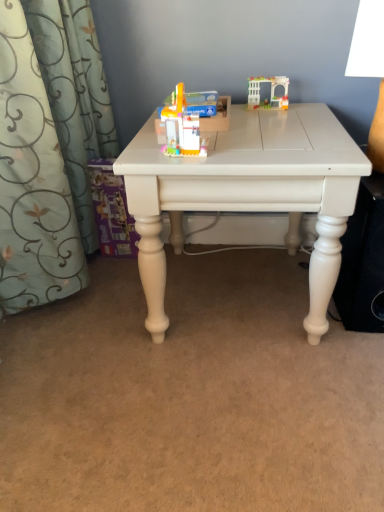
Question: From their relative heights in the image, would you say white matte speaker at lower right is taller or shorter than translucent plastic archway at upper right, the second toy when ordered from bottom to top?

Choices:
 (A) short
 (B) tall

Answer: (B)

Question: Is white matte speaker at lower right inside the boundaries of translucent plastic archway at upper right, the 1th toy from the back, or outside?

Choices:
 (A) inside
 (B) outside

Answer: (B)

Question: Which object is the closest to the white matte table at center?

Choices:
 (A) white matte speaker at lower right
 (B) translucent plastic toy at center, which appears as the 1th toy when ordered from the bottom
 (C) white plastic lampshade at upper right
 (D) translucent plastic archway at upper right, which is the 1th toy from top to bottom

Answer: (B)

Question: Estimate the real-world distances between objects in this image. Which object is farther from the translucent plastic toy at center, which appears as the 1th toy when ordered from the bottom?

Choices:
 (A) white plastic lampshade at upper right
 (B) white matte speaker at lower right
 (C) translucent plastic archway at upper right, the second toy when ordered from bottom to top
 (D) white matte table at center

Answer: (B)